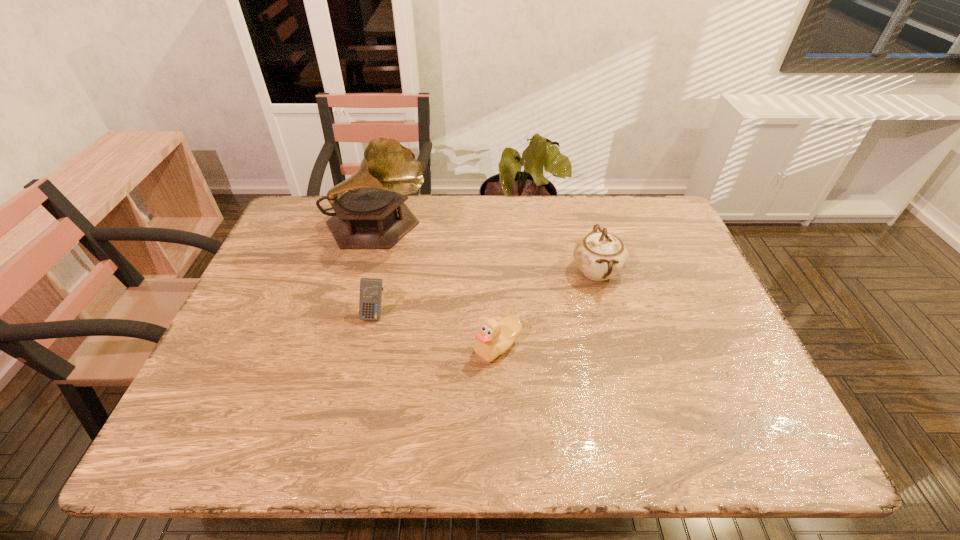
In the image, there is a desktop. What are the coordinates of `vacant space at the far right corner` in the screenshot? It's located at (660, 214).

What are the coordinates of `vacant region at the near right corner` in the screenshot? It's located at (785, 437).

You are a GUI agent. You are given a task and a screenshot of the screen. Output one action in this format:
    pyautogui.click(x=<x>, y=<y>)
    Task: Click on the vacant area between the chinaware and the nearest object
    This screenshot has width=960, height=540.
    Given the screenshot: What is the action you would take?
    pyautogui.click(x=547, y=309)

Identify the location of free spot between the phonograph record and the third object from left to right. (438, 287).

This screenshot has height=540, width=960. In order to click on empty location between the nearest object and the rightmost object in this screenshot , I will do `click(547, 309)`.

What are the coordinates of `vacant point located between the phonograph record and the second object from right to left` in the screenshot? It's located at (438, 287).

The height and width of the screenshot is (540, 960). In order to click on vacant space in between the second object from right to left and the second nearest object in this screenshot , I will do `click(436, 330)`.

The width and height of the screenshot is (960, 540). I want to click on vacant region between the third farthest object and the tallest object, so click(x=375, y=271).

Identify the location of unoccupied position between the calculator and the tallest object. The image size is (960, 540). (375, 271).

The image size is (960, 540). What are the coordinates of `free spot between the nearest object and the calculator` in the screenshot? It's located at (436, 330).